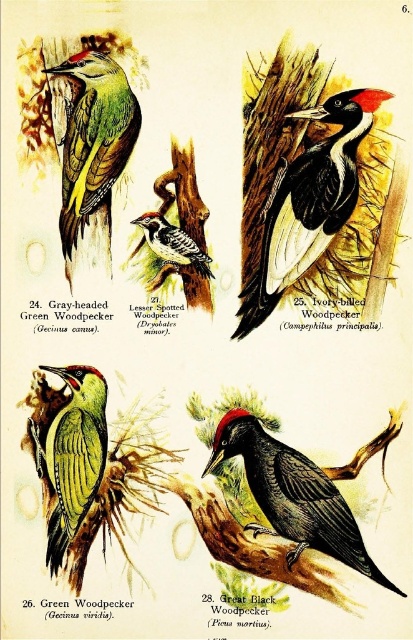
Is point (109, 93) positioned before point (64, 477)?

That is True.

Between green matte woodpecker at upper left and green matte woodpecker at center, which one has less height?

green matte woodpecker at center is shorter.

Image resolution: width=413 pixels, height=640 pixels. In order to click on green matte woodpecker at upper left in this screenshot , I will do `click(92, 145)`.

Is green matte woodpecker at center thinner than speckled brown woodpecker at center?

No, green matte woodpecker at center is not thinner than speckled brown woodpecker at center.

Is point (68, 372) closer to camera compared to point (151, 236)?

That is True.

Which is behind, point (90, 416) or point (194, 256)?

The point (194, 256) is behind.

Image resolution: width=413 pixels, height=640 pixels. Identify the location of green matte woodpecker at center. (73, 454).

Is black glossy ivory-billed woodpecker at upper right bigger than speckled brown woodpecker at center?

Yes.

This screenshot has height=640, width=413. Describe the element at coordinates (308, 202) in the screenshot. I see `black glossy ivory-billed woodpecker at upper right` at that location.

Identify the location of black glossy ivory-billed woodpecker at upper right. (308, 202).